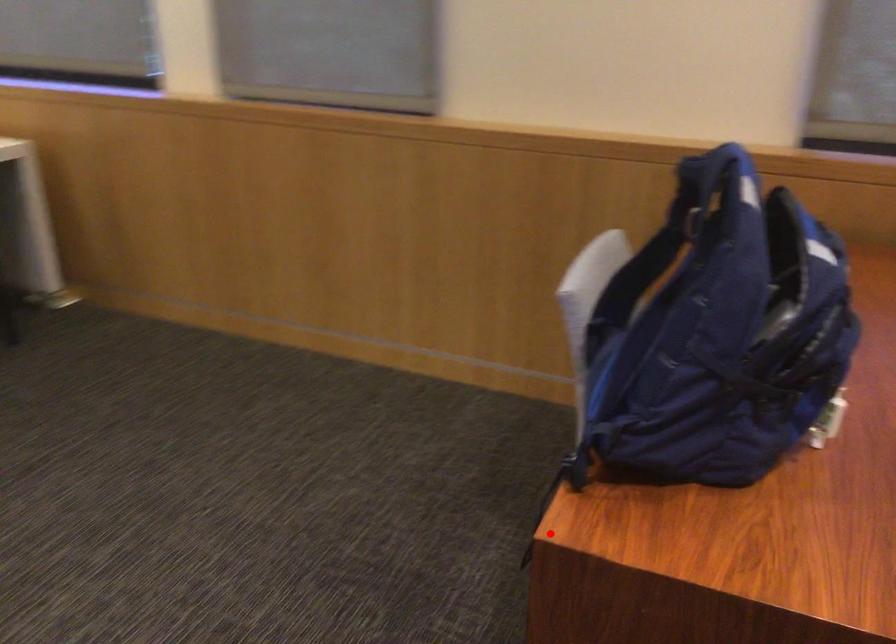
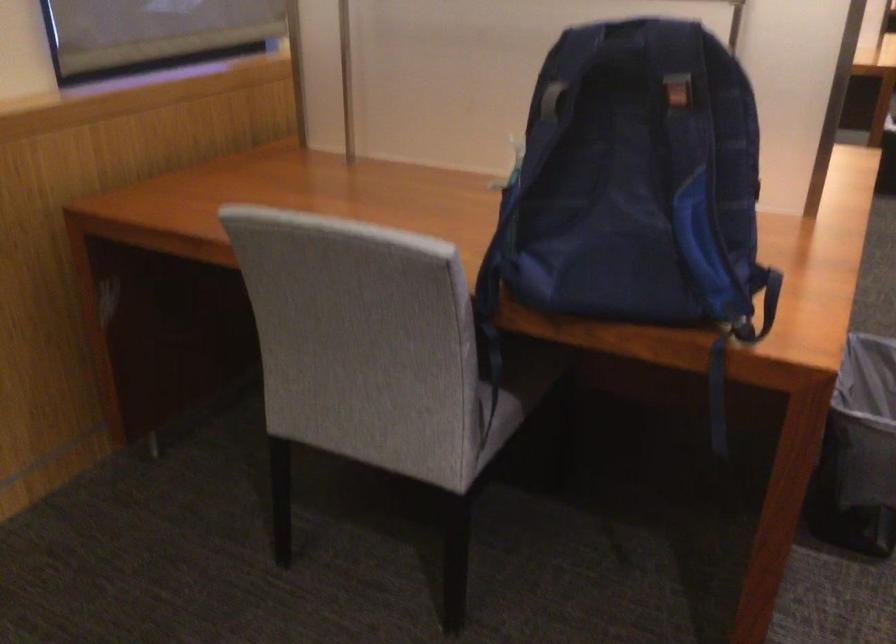
Question: I am providing you with two images of the same scene from different viewpoints. A red point is shown in image1. For the corresponding object point in image2, is it positioned nearer or farther from the camera?

Choices:
 (A) Nearer
 (B) Farther

Answer: (B)